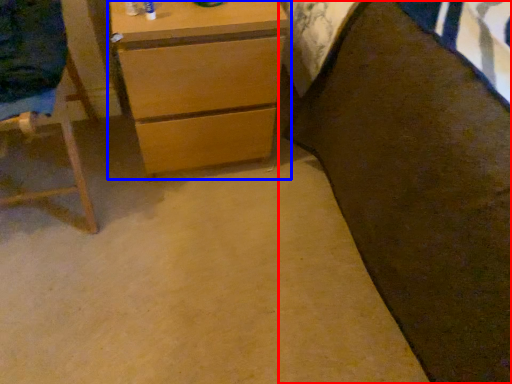
Question: Which of the following is the farthest to the observer, bed (highlighted by a red box) or chest of drawers (highlighted by a blue box)?

Choices:
 (A) bed
 (B) chest of drawers

Answer: (B)